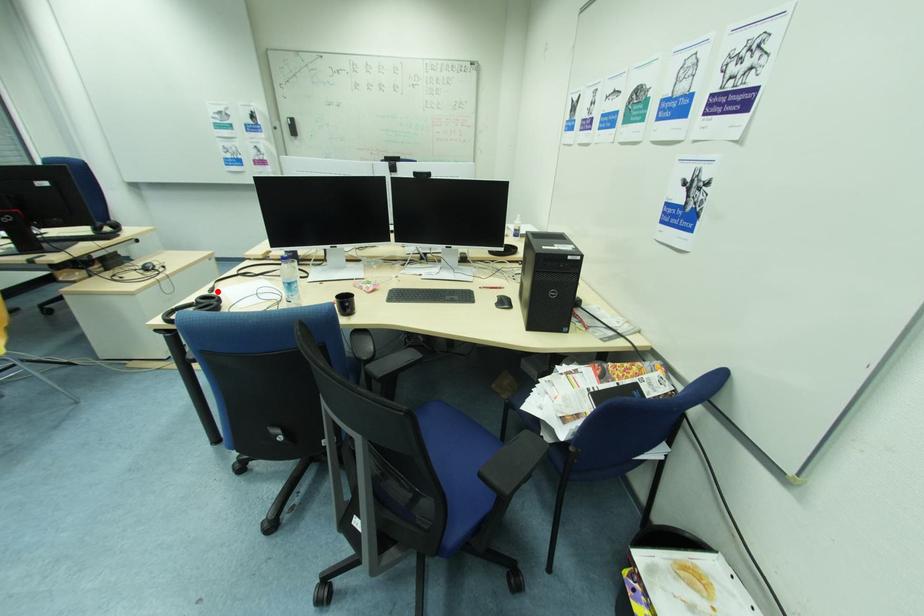
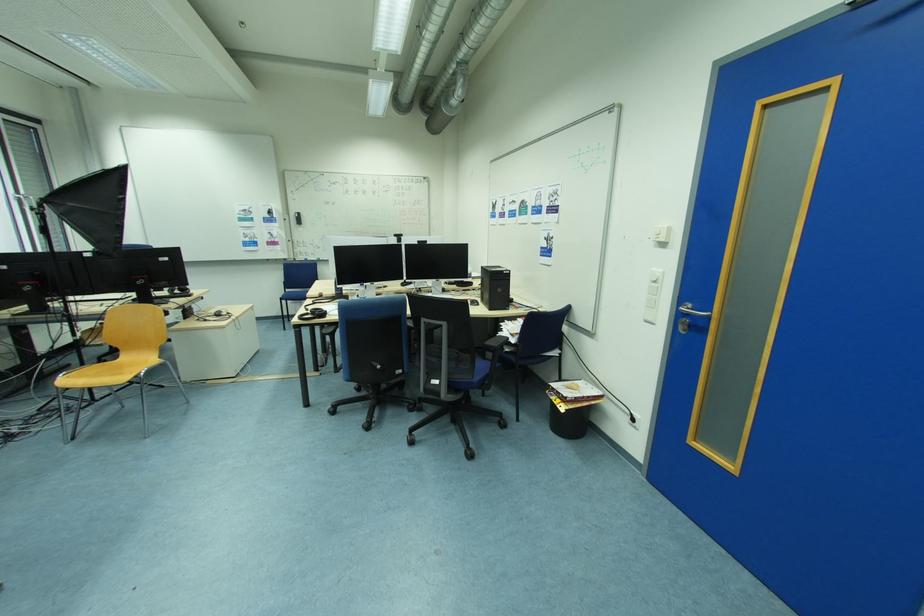
Where in the second image is the point corresponding to the highlighted location from the first image?

(313, 310)